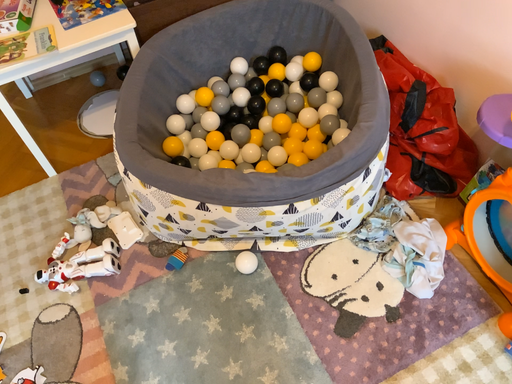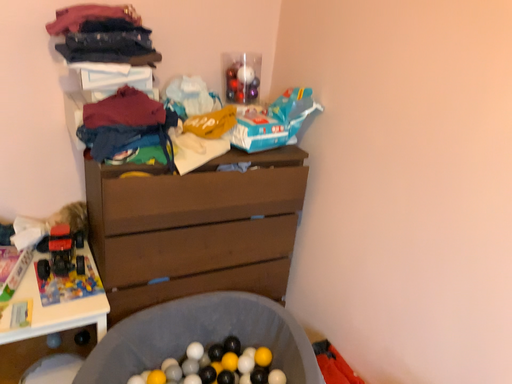
Question: Which way did the camera rotate in the video?

Choices:
 (A) rotated left
 (B) rotated right

Answer: (B)